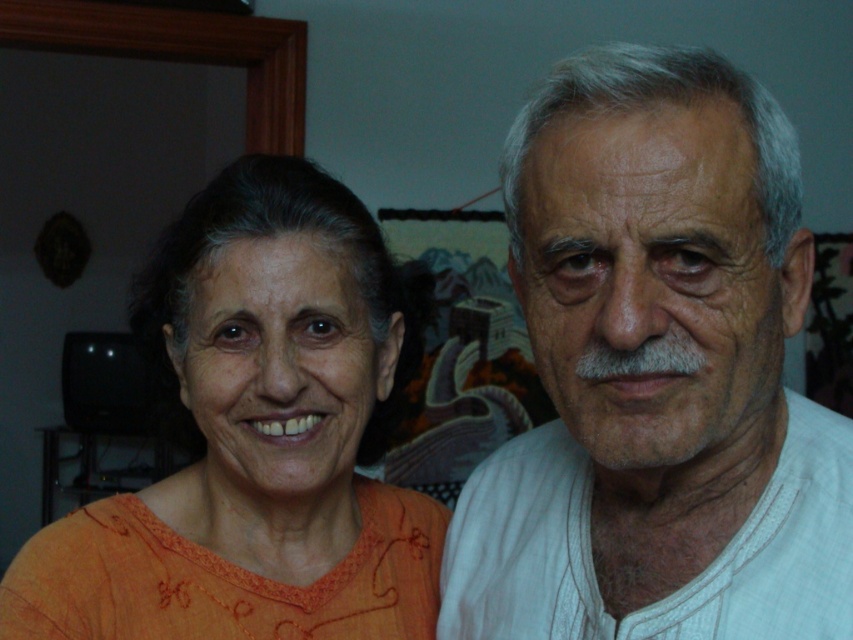
Which is above, white cotton shirt at right or orange embroidered top at left?

orange embroidered top at left

Does point (648, 58) lie behind point (363, 518)?

That is False.

Image resolution: width=853 pixels, height=640 pixels. I want to click on white cotton shirt at right, so click(x=656, y=376).